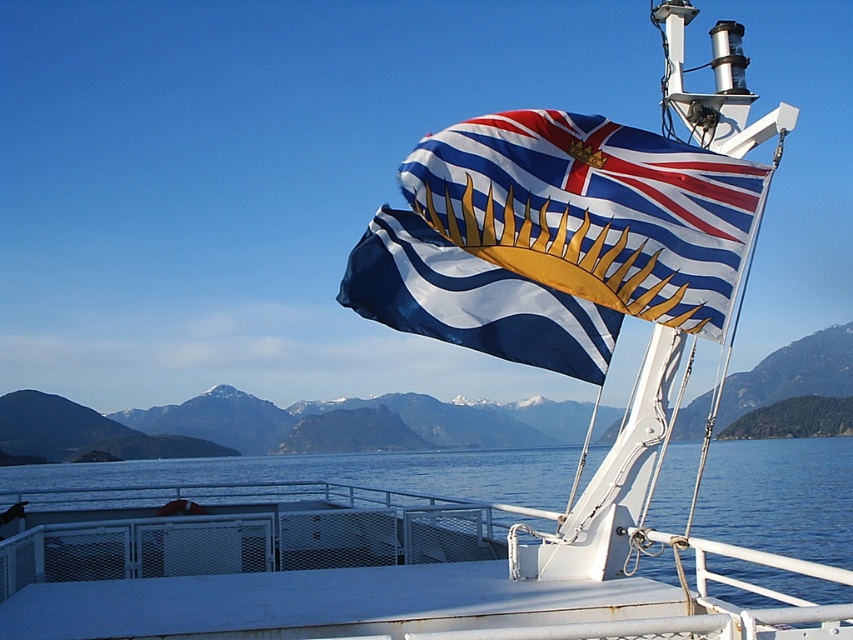
You are standing on the deck of the boat and want to move from point A to point B. Point A is at coordinate point (610, 348) and point B is at coordinate point (741, 461). Which point is closer to you when you start at point A?

Point A is closer to the viewer than point B, so when starting at point A, point A is already closer to you compared to point B.

You are standing on the deck of a boat and see a point at coordinates (555, 237). What object is located at that point?

The point at (555, 237) corresponds to the blue and white striped flag at upper center.

You are standing on the deck of the boat and want to take a photo of both the blue and white striped flag at upper center and the blue water at center. Which object should you focus on first to ensure both are in clear view?

You should focus on the blue and white striped flag at upper center first because it is closer to you than the blue water at center. By focusing on the closer object, the background will also be in focus due to the depth of field.